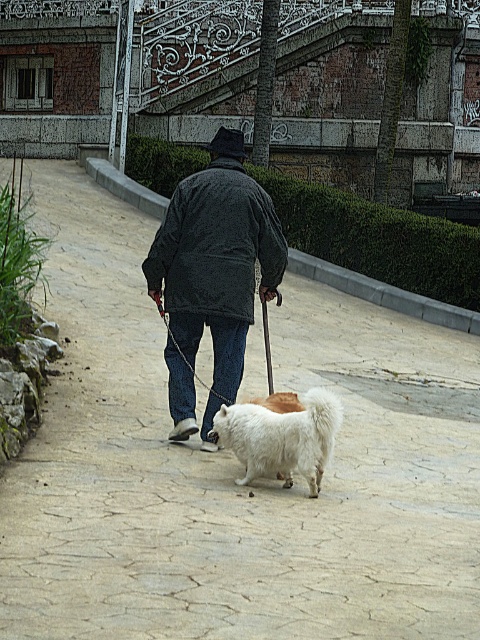
Question: Can you confirm if dark gray fleece jacket at center is positioned above white fluffy dog at center?

Choices:
 (A) no
 (B) yes

Answer: (B)

Question: Considering the relative positions of dark gray fleece jacket at center and white fluffy dog at center in the image provided, where is dark gray fleece jacket at center located with respect to white fluffy dog at center?

Choices:
 (A) below
 (B) above

Answer: (B)

Question: Can you confirm if dark gray fleece jacket at center is positioned to the right of white fluffy dog at center?

Choices:
 (A) no
 (B) yes

Answer: (A)

Question: Among these points, which one is farthest from the camera?

Choices:
 (A) (192, 176)
 (B) (268, 426)

Answer: (A)

Question: Which object appears farthest from the camera in this image?

Choices:
 (A) dark gray fleece jacket at center
 (B) white fluffy dog at center

Answer: (A)

Question: Among these objects, which one is nearest to the camera?

Choices:
 (A) white fluffy dog at center
 (B) dark gray fleece jacket at center

Answer: (A)